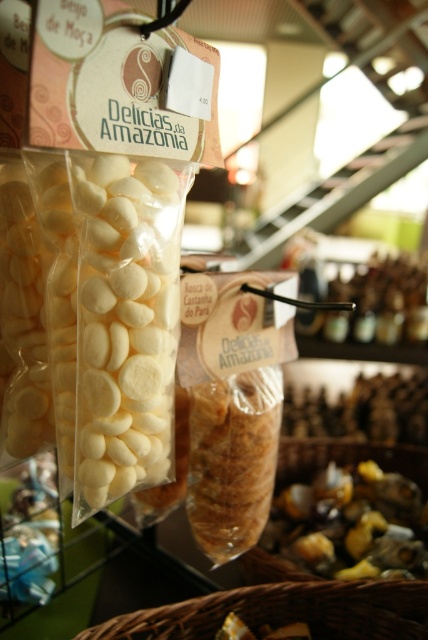
You are a customer at a store and want to know which snack is taller between the white matte candy at center and the shiny metallic nuts at lower right. Based on the scene description, which one is taller?

The white matte candy at center is taller than the shiny metallic nuts at lower right according to the description.

What is located at the point with coordinates (350, 524)?

The point with coordinates (350, 524) is on shiny metallic nuts at lower right.